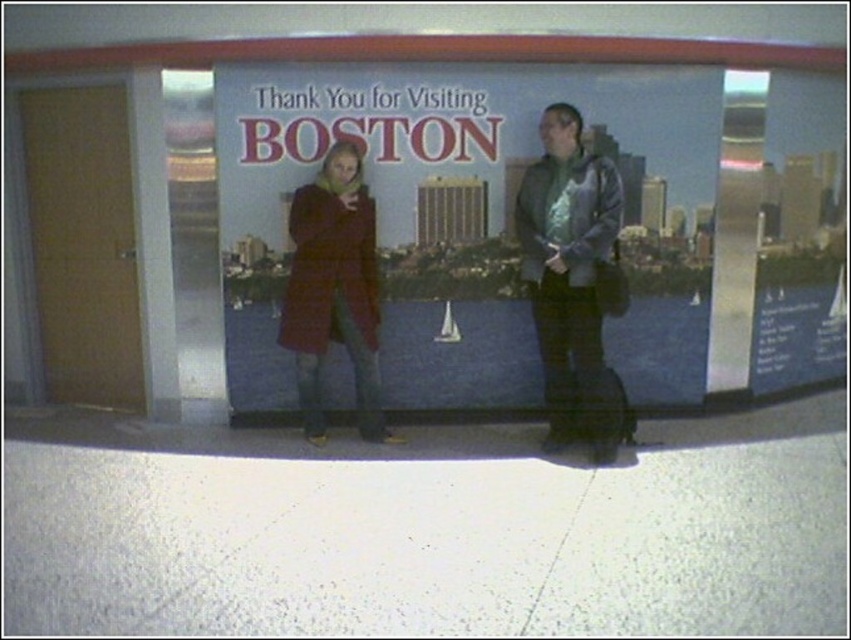
Question: Is metallic silver jacket at right closer to the viewer compared to matte red coat at center?

Choices:
 (A) yes
 (B) no

Answer: (A)

Question: Which of these objects is positioned closest to the matte red coat at center?

Choices:
 (A) metallic silver jacket at right
 (B) matte plastic poster at center

Answer: (B)

Question: Can you confirm if matte plastic poster at center is positioned to the left of metallic silver jacket at right?

Choices:
 (A) yes
 (B) no

Answer: (A)

Question: Which point is farther to the camera?

Choices:
 (A) (538, 221)
 (B) (301, 236)
 (C) (241, 340)

Answer: (C)

Question: Among these objects, which one is farthest from the camera?

Choices:
 (A) matte plastic poster at center
 (B) metallic silver jacket at right
 (C) matte red coat at center

Answer: (C)

Question: Can you confirm if matte plastic poster at center is positioned below metallic silver jacket at right?

Choices:
 (A) yes
 (B) no

Answer: (B)